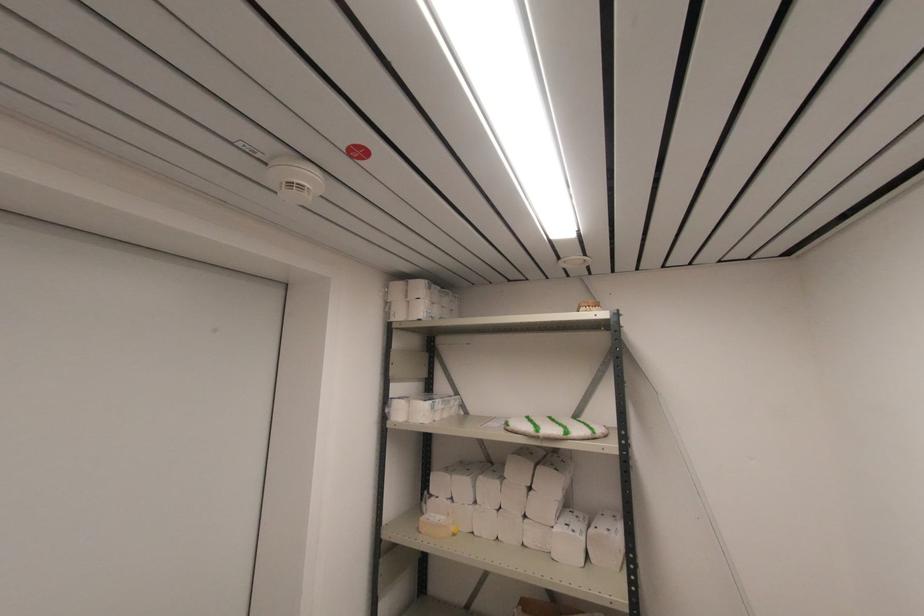
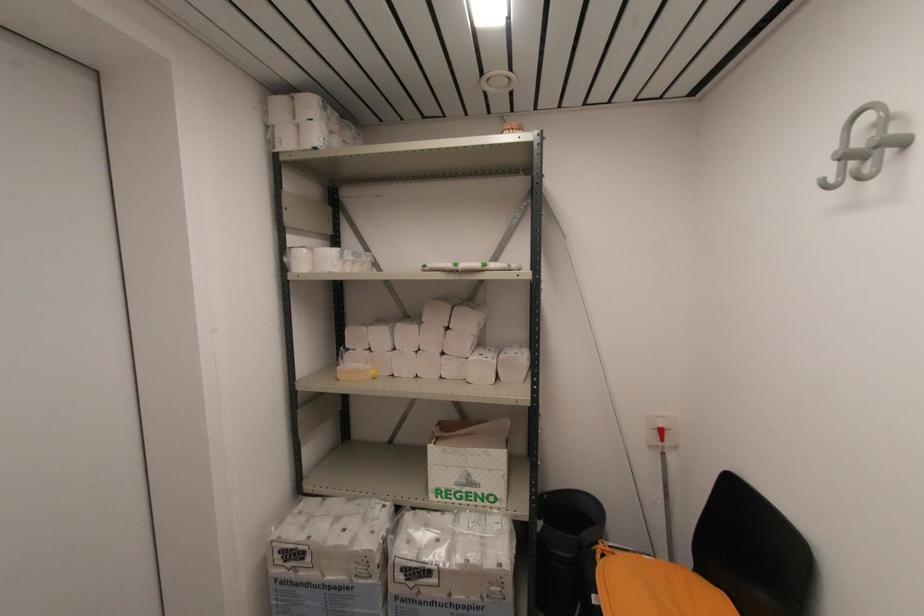
The point at (420, 533) is marked in the first image. Where is the corresponding point in the second image?

(339, 381)